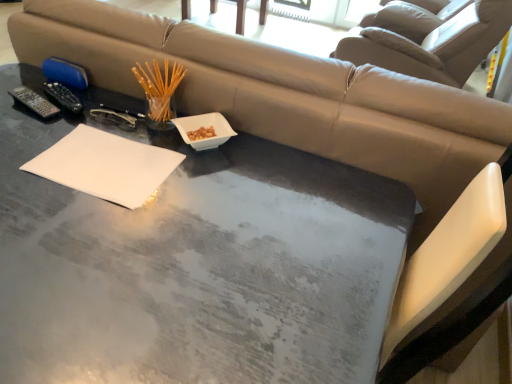
Identify the location of vacant area that lies to the right of black plastic remote at left. (104, 114).